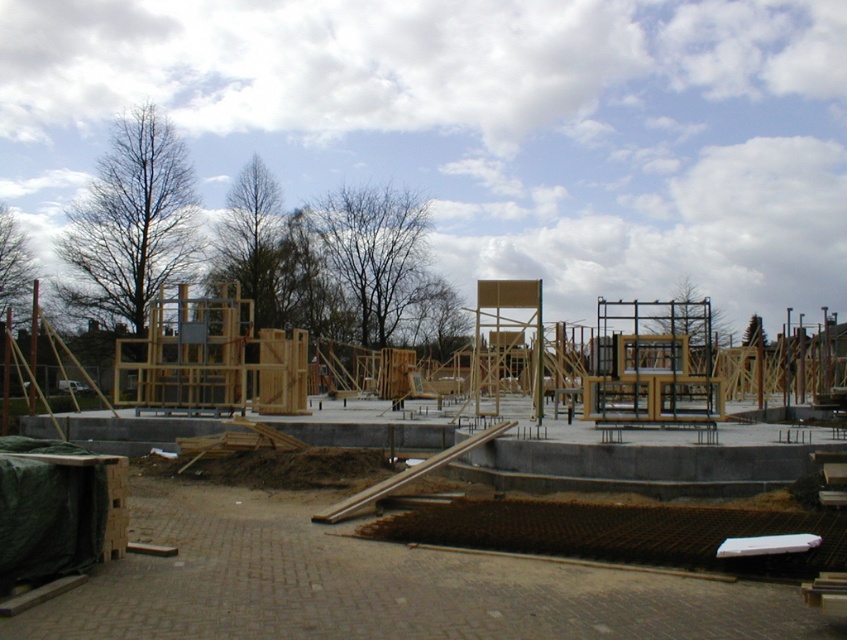
Can you confirm if natural wood construction at center is positioned below gray concrete foundation at center?

Actually, natural wood construction at center is above gray concrete foundation at center.

The height and width of the screenshot is (640, 847). What do you see at coordinates (303, 580) in the screenshot? I see `natural wood construction at center` at bounding box center [303, 580].

Who is more forward, (368, 596) or (805, 445)?

Point (368, 596) is more forward.

I want to click on natural wood construction at center, so (303, 580).